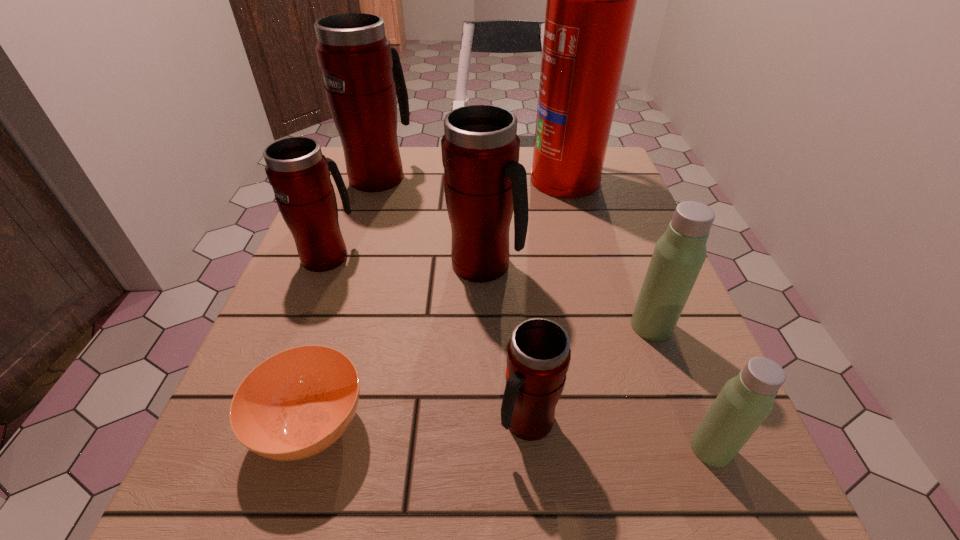
Locate an element on the screen. vacant space located on the side with the handle of the third biggest red thermos bottle is located at coordinates (364, 162).

At what (x,y) coordinates should I click in order to perform the action: click on free space located on the side with the handle of the third biggest red thermos bottle. Please return your answer as a coordinate pair (x, y). This screenshot has height=540, width=960. Looking at the image, I should click on (359, 176).

The width and height of the screenshot is (960, 540). In order to click on free space located 0.050m on the side with the handle of the nearest red thermos bottle in this screenshot , I will do `click(533, 489)`.

The width and height of the screenshot is (960, 540). Identify the location of vacant space located on the back of the smaller light thermos bottle. (640, 269).

Locate an element on the screen. vacant space located on the right of the shortest object is located at coordinates (438, 425).

This screenshot has width=960, height=540. In order to click on fire extinguisher positioned at the far edge in this screenshot , I will do `click(591, 0)`.

At what (x,y) coordinates should I click in order to perform the action: click on thermos bottle that is positioned at the far edge. Please return your answer as a coordinate pair (x, y). This screenshot has width=960, height=540. Looking at the image, I should click on (362, 72).

Find the location of a particular element. This screenshot has height=540, width=960. object at the near edge is located at coordinates (297, 403).

Locate an element on the screen. The width and height of the screenshot is (960, 540). soup bowl located in the left edge section of the desktop is located at coordinates (297, 403).

Identify the location of fire extinguisher that is at the right edge. (591, 0).